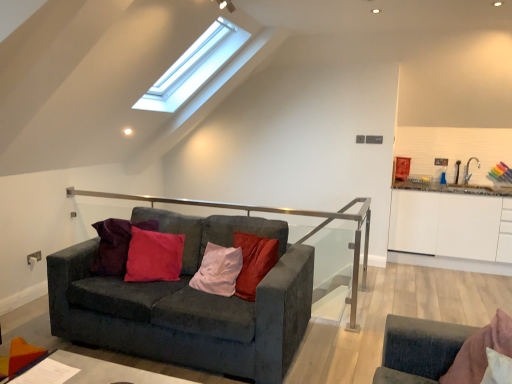
Question: Is velvet dark gray couch at center surrounded by smooth gray table at lower left?

Choices:
 (A) yes
 (B) no

Answer: (B)

Question: From a real-world perspective, is smooth gray table at lower left over velvet dark gray couch at center?

Choices:
 (A) yes
 (B) no

Answer: (B)

Question: Is smooth gray table at lower left shorter than velvet dark gray couch at center?

Choices:
 (A) yes
 (B) no

Answer: (A)

Question: Is smooth gray table at lower left turned away from velvet dark gray couch at center?

Choices:
 (A) no
 (B) yes

Answer: (A)

Question: Considering the relative sizes of smooth gray table at lower left and velvet dark gray couch at center in the image provided, is smooth gray table at lower left thinner than velvet dark gray couch at center?

Choices:
 (A) no
 (B) yes

Answer: (B)

Question: Is smooth gray table at lower left spatially inside white glossy cabinet at right, or outside of it?

Choices:
 (A) outside
 (B) inside

Answer: (A)

Question: From the image's perspective, is smooth gray table at lower left positioned above or below white glossy cabinet at right?

Choices:
 (A) above
 (B) below

Answer: (B)

Question: Is smooth gray table at lower left bigger or smaller than white glossy cabinet at right?

Choices:
 (A) big
 (B) small

Answer: (B)

Question: In terms of height, does smooth gray table at lower left look taller or shorter compared to white glossy cabinet at right?

Choices:
 (A) tall
 (B) short

Answer: (B)

Question: Visually, is smooth gray table at lower left positioned to the left or to the right of velvet dark gray couch at center?

Choices:
 (A) right
 (B) left

Answer: (B)

Question: Do you think smooth gray table at lower left is within velvet dark gray couch at center, or outside of it?

Choices:
 (A) inside
 (B) outside

Answer: (B)

Question: Considering their positions, is smooth gray table at lower left located in front of or behind velvet dark gray couch at center?

Choices:
 (A) front
 (B) behind

Answer: (A)

Question: Does point (60, 357) appear closer or farther from the camera than point (197, 264)?

Choices:
 (A) closer
 (B) farther

Answer: (A)

Question: From a real-world perspective, relative to velvet dark gray couch at center, is white glossy cabinet at right vertically above or below?

Choices:
 (A) below
 (B) above

Answer: (B)

Question: Relative to velvet dark gray couch at center, is white glossy cabinet at right in front or behind?

Choices:
 (A) behind
 (B) front

Answer: (A)